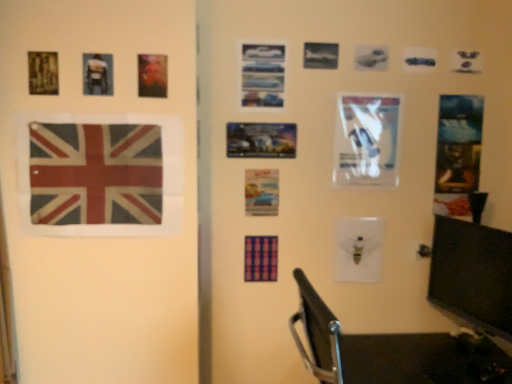
Question: Is textured fabric flag at left facing away from pastel paper postcard at center, which is counted as the fourth postcard, starting from the right?

Choices:
 (A) yes
 (B) no

Answer: (B)

Question: From the image's perspective, does textured fabric flag at left appear higher than pastel paper postcard at center, which appears as the 2th postcard when viewed from the left?

Choices:
 (A) no
 (B) yes

Answer: (B)

Question: Can you confirm if textured fabric flag at left is thinner than pastel paper postcard at center, which is the 2th postcard in back-to-front order?

Choices:
 (A) yes
 (B) no

Answer: (B)

Question: Can you confirm if textured fabric flag at left is shorter than pastel paper postcard at center, which appears as the 2th postcard when viewed from the left?

Choices:
 (A) no
 (B) yes

Answer: (A)

Question: Are textured fabric flag at left and pastel paper postcard at center, which is the 2th postcard in back-to-front order, located far from each other?

Choices:
 (A) yes
 (B) no

Answer: (B)

Question: Is metallic silver poster at center, marked as the 1th picture frame in a right-to-left arrangement, wider or thinner than shiny metallic postcard at upper left, positioned as the first postcard in front-to-back order?

Choices:
 (A) wide
 (B) thin

Answer: (B)

Question: From a real-world perspective, relative to shiny metallic postcard at upper left, which ranks as the fifth postcard in back-to-front order, is metallic silver poster at center, marked as the 1th picture frame in a right-to-left arrangement, vertically above or below?

Choices:
 (A) above
 (B) below

Answer: (B)

Question: In terms of size, does metallic silver poster at center, placed as the first picture frame when sorted from back to front, appear bigger or smaller than shiny metallic postcard at upper left, which ranks as the fifth postcard in back-to-front order?

Choices:
 (A) small
 (B) big

Answer: (B)

Question: Is metallic silver poster at center, the 1th picture frame in the bottom-to-top sequence, taller or shorter than shiny metallic postcard at upper left, the 1th postcard viewed from the left?

Choices:
 (A) tall
 (B) short

Answer: (B)

Question: Looking at the image, does metallic blue postcard at upper center, which ranks as the third postcard in left-to-right order, seem bigger or smaller compared to metallic silver poster at center, marked as the second picture frame in a top-to-bottom arrangement?

Choices:
 (A) big
 (B) small

Answer: (A)

Question: Considering the positions of point (248, 49) and point (279, 137), is point (248, 49) closer or farther from the camera than point (279, 137)?

Choices:
 (A) farther
 (B) closer

Answer: (B)

Question: Considering their positions, is metallic blue postcard at upper center, the 4th postcard viewed from the back, located in front of or behind metallic silver poster at center, the 2th picture frame in the front-to-back sequence?

Choices:
 (A) front
 (B) behind

Answer: (A)

Question: From their relative heights in the image, would you say metallic blue postcard at upper center, the second postcard from the front, is taller or shorter than metallic silver poster at center, which appears as the second picture frame when viewed from the left?

Choices:
 (A) short
 (B) tall

Answer: (B)

Question: Considering the positions of matte black backpack at upper left, which is the 1th picture frame in front-to-back order, and metallic blue postcard at upper center, the 4th postcard viewed from the back, in the image, is matte black backpack at upper left, which is the 1th picture frame in front-to-back order, taller or shorter than metallic blue postcard at upper center, the 4th postcard viewed from the back,?

Choices:
 (A) tall
 (B) short

Answer: (B)

Question: From a real-world perspective, relative to metallic blue postcard at upper center, the second postcard from the front, is matte black backpack at upper left, positioned as the 2th picture frame in right-to-left order, vertically above or below?

Choices:
 (A) above
 (B) below

Answer: (B)